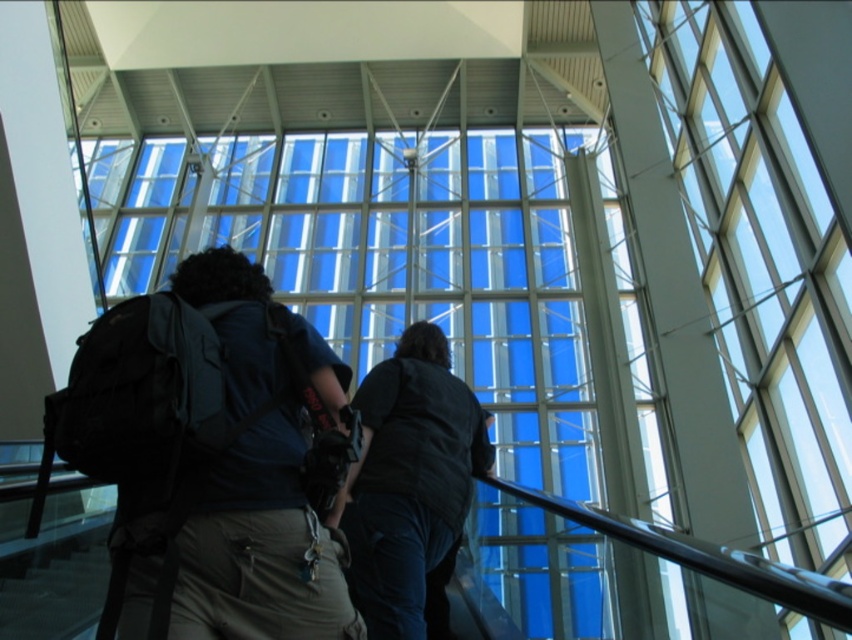
Question: Which object is positioned closest to the transparent glass window at center?

Choices:
 (A) dark blue shirt at center
 (B) transparent glass window at upper right
 (C) dark blue fabric backpack at center

Answer: (A)

Question: Estimate the real-world distances between objects in this image. Which object is closer to the transparent glass window at upper right?

Choices:
 (A) dark blue shirt at center
 (B) dark blue fabric backpack at center

Answer: (A)

Question: Based on their relative distances, which object is nearer to the dark blue shirt at center?

Choices:
 (A) transparent glass window at center
 (B) dark blue fabric backpack at center
 (C) transparent glass window at upper right

Answer: (B)

Question: Does transparent glass window at upper right appear under dark blue shirt at center?

Choices:
 (A) yes
 (B) no

Answer: (B)

Question: Does transparent glass window at upper right have a lesser width compared to dark blue shirt at center?

Choices:
 (A) yes
 (B) no

Answer: (A)

Question: Does transparent glass window at upper right lie behind dark blue fabric backpack at center?

Choices:
 (A) yes
 (B) no

Answer: (A)